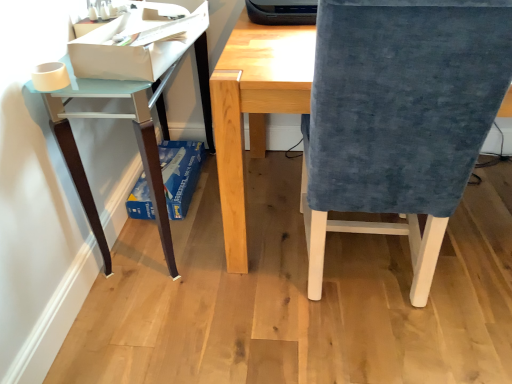
Find the location of a particular element. The image size is (512, 384). velvet blue chair at right is located at coordinates (399, 118).

This screenshot has height=384, width=512. In order to click on blue cardboard box at lower left, the second paperback book from the front in this screenshot , I will do `click(180, 174)`.

What is the approximate width of white paper at upper left, arranged as the 1th paperback book when viewed from the front?

white paper at upper left, arranged as the 1th paperback book when viewed from the front, is 10.49 inches wide.

Identify the location of white paper at upper left, positioned as the second paperback book in back-to-front order. coord(136,46).

Find the location of a particular element. Image resolution: width=512 pixels, height=384 pixels. light blue glossy table at left is located at coordinates (134, 105).

In the image, is white paper at upper left, arranged as the 1th paperback book when viewed from the front, on the left side or the right side of velvet blue chair at right?

white paper at upper left, arranged as the 1th paperback book when viewed from the front, is positioned on velvet blue chair at right's left side.

From a real-world perspective, which is physically above, white paper at upper left, which is counted as the 1th paperback book, starting from the top, or velvet blue chair at right?

white paper at upper left, which is counted as the 1th paperback book, starting from the top, from a real-world perspective.

Looking at the image, does white paper at upper left, arranged as the 1th paperback book when viewed from the front, seem bigger or smaller compared to velvet blue chair at right?

white paper at upper left, arranged as the 1th paperback book when viewed from the front, is smaller than velvet blue chair at right.

Does point (146, 30) come behind point (436, 250)?

No, it is not.

From the image's perspective, is velvet blue chair at right above or below light blue glossy table at left?

Clearly, from the image's perspective, velvet blue chair at right is below light blue glossy table at left.

Considering the sizes of objects velvet blue chair at right and light blue glossy table at left in the image provided, who is thinner, velvet blue chair at right or light blue glossy table at left?

light blue glossy table at left is thinner.

Are velvet blue chair at right and light blue glossy table at left located far from each other?

They are positioned close to each other.

Does velvet blue chair at right have a greater height compared to light blue glossy table at left?

Correct, velvet blue chair at right is much taller as light blue glossy table at left.

Considering the relative sizes of blue cardboard box at lower left, the 1th paperback book from the bottom, and light blue glossy table at left in the image provided, is blue cardboard box at lower left, the 1th paperback book from the bottom, shorter than light blue glossy table at left?

Correct, blue cardboard box at lower left, the 1th paperback book from the bottom, is not as tall as light blue glossy table at left.

From a real-world perspective, is blue cardboard box at lower left, the first paperback book positioned from the back, positioned under light blue glossy table at left based on gravity?

Correct, in the physical world, blue cardboard box at lower left, the first paperback book positioned from the back, is lower than light blue glossy table at left.

Considering the relative sizes of blue cardboard box at lower left, the first paperback book positioned from the back, and light blue glossy table at left in the image provided, is blue cardboard box at lower left, the first paperback book positioned from the back, bigger than light blue glossy table at left?

Actually, blue cardboard box at lower left, the first paperback book positioned from the back, might be smaller than light blue glossy table at left.

From the image's perspective, would you say blue cardboard box at lower left, the 1th paperback book from the bottom, is shown under light blue glossy table at left?

Yes.

Which is farther from the camera, [403,11] or [105,24]?

The point [105,24] is farther.

Is white paper at upper left, arranged as the 1th paperback book when viewed from the front, at the back of velvet blue chair at right?

No, velvet blue chair at right is not facing the opposite direction of white paper at upper left, arranged as the 1th paperback book when viewed from the front.

Can we say velvet blue chair at right lies outside white paper at upper left, which ranks as the 2th paperback book in bottom-to-top order?

Yes, velvet blue chair at right is outside of white paper at upper left, which ranks as the 2th paperback book in bottom-to-top order.

Which is more to the right, velvet blue chair at right or white paper at upper left, positioned as the second paperback book in back-to-front order?

velvet blue chair at right.

Is point (477, 148) less distant than point (198, 158)?

Yes, it is.

Do you think velvet blue chair at right is within blue cardboard box at lower left, which ranks as the 2th paperback book in top-to-bottom order, or outside of it?

velvet blue chair at right exists outside the volume of blue cardboard box at lower left, which ranks as the 2th paperback book in top-to-bottom order.

Who is shorter, velvet blue chair at right or blue cardboard box at lower left, the first paperback book positioned from the back?

blue cardboard box at lower left, the first paperback book positioned from the back.

Between velvet blue chair at right and blue cardboard box at lower left, which ranks as the 2th paperback book in top-to-bottom order, which one is positioned behind?

blue cardboard box at lower left, which ranks as the 2th paperback book in top-to-bottom order.

From the image's perspective, which is above, light blue glossy table at left or blue cardboard box at lower left, the first paperback book positioned from the back?

From the image's view, light blue glossy table at left is above.

Identify the location of table located above the blue cardboard box at lower left, the first paperback book positioned from the back (from a real-world perspective). (134, 105).

Considering the relative sizes of light blue glossy table at left and blue cardboard box at lower left, which ranks as the 2th paperback book in top-to-bottom order, in the image provided, is light blue glossy table at left wider than blue cardboard box at lower left, which ranks as the 2th paperback book in top-to-bottom order,?

Correct, the width of light blue glossy table at left exceeds that of blue cardboard box at lower left, which ranks as the 2th paperback book in top-to-bottom order.

Can we say light blue glossy table at left lies outside blue cardboard box at lower left, the first paperback book positioned from the back?

light blue glossy table at left is positioned outside blue cardboard box at lower left, the first paperback book positioned from the back.

Which object is further away from the camera taking this photo, light blue glossy table at left or white paper at upper left, arranged as the 1th paperback book when viewed from the front?

light blue glossy table at left is more distant.

Between point (195, 27) and point (195, 38), which one is positioned behind?

The point (195, 27) is farther.

Locate an element on the screen. paperback book in front of the light blue glossy table at left is located at coordinates (136, 46).

Image resolution: width=512 pixels, height=384 pixels. I want to click on the 1st paperback book to the left when counting from the velvet blue chair at right, so tap(136, 46).

What are the coordinates of `table below the velvet blue chair at right (from a real-world perspective)` in the screenshot? It's located at (134, 105).

Estimate the real-world distances between objects in this image. Which object is further from white paper at upper left, which ranks as the 2th paperback book in bottom-to-top order, blue cardboard box at lower left, the first paperback book positioned from the back, or light blue glossy table at left?

Among the two, blue cardboard box at lower left, the first paperback book positioned from the back, is located further to white paper at upper left, which ranks as the 2th paperback book in bottom-to-top order.

Looking at the image, which one is located closer to light blue glossy table at left, velvet blue chair at right or blue cardboard box at lower left, the 1th paperback book from the bottom?

The object closer to light blue glossy table at left is blue cardboard box at lower left, the 1th paperback book from the bottom.

Which object lies further to the anchor point light blue glossy table at left, blue cardboard box at lower left, the second paperback book from the front, or white paper at upper left, positioned as the second paperback book in back-to-front order?

blue cardboard box at lower left, the second paperback book from the front, lies further to light blue glossy table at left than the other object.

Looking at the image, which one is located further to white paper at upper left, which is counted as the 1th paperback book, starting from the top, velvet blue chair at right or blue cardboard box at lower left, the second paperback book from the front?

blue cardboard box at lower left, the second paperback book from the front, is positioned further to the anchor white paper at upper left, which is counted as the 1th paperback book, starting from the top.

When comparing their distances from light blue glossy table at left, does blue cardboard box at lower left, the first paperback book positioned from the back, or velvet blue chair at right seem further?

velvet blue chair at right.

When comparing their distances from blue cardboard box at lower left, which ranks as the 2th paperback book in top-to-bottom order, does velvet blue chair at right or white paper at upper left, positioned as the second paperback book in back-to-front order, seem further?

velvet blue chair at right is positioned further to the anchor blue cardboard box at lower left, which ranks as the 2th paperback book in top-to-bottom order.

When comparing their distances from light blue glossy table at left, does white paper at upper left, which is counted as the 1th paperback book, starting from the top, or blue cardboard box at lower left, the second paperback book from the front, seem closer?

white paper at upper left, which is counted as the 1th paperback book, starting from the top, is positioned closer to the anchor light blue glossy table at left.

Which object lies nearer to the anchor point white paper at upper left, which ranks as the 2th paperback book in bottom-to-top order, light blue glossy table at left or blue cardboard box at lower left, the first paperback book positioned from the back?

light blue glossy table at left is closer to white paper at upper left, which ranks as the 2th paperback book in bottom-to-top order.

Where is `table between velvet blue chair at right and blue cardboard box at lower left, the 1th paperback book from the bottom, in the front-back direction`? The height and width of the screenshot is (384, 512). table between velvet blue chair at right and blue cardboard box at lower left, the 1th paperback book from the bottom, in the front-back direction is located at coordinates (134, 105).

Where is `table between white paper at upper left, which ranks as the 2th paperback book in bottom-to-top order, and blue cardboard box at lower left, the second paperback book from the front, from front to back`? table between white paper at upper left, which ranks as the 2th paperback book in bottom-to-top order, and blue cardboard box at lower left, the second paperback book from the front, from front to back is located at coordinates (134, 105).

At what (x,y) coordinates should I click in order to perform the action: click on paperback book between light blue glossy table at left and velvet blue chair at right from left to right. Please return your answer as a coordinate pair (x, y). Looking at the image, I should click on (136, 46).

Locate an element on the screen. This screenshot has height=384, width=512. paperback book between velvet blue chair at right and blue cardboard box at lower left, the second paperback book from the front, from front to back is located at coordinates (136, 46).